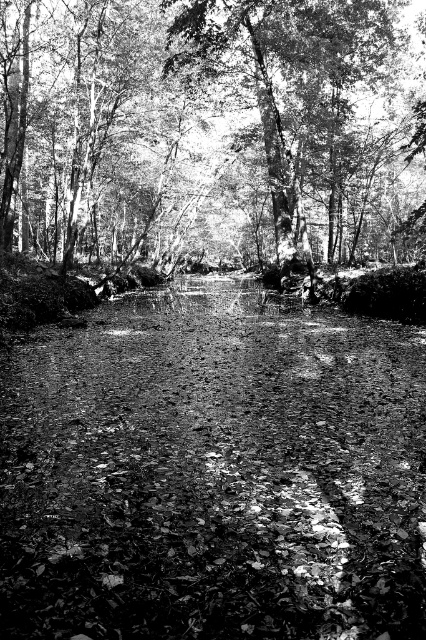
Question: Which point is farther from the camera taking this photo?

Choices:
 (A) (328, 106)
 (B) (322, 442)

Answer: (A)

Question: Observing the image, what is the correct spatial positioning of smooth dirt path at center in reference to smooth bark tree at center?

Choices:
 (A) above
 (B) below

Answer: (B)

Question: Which of the following is the closest to the observer?

Choices:
 (A) (104, 513)
 (B) (201, 168)

Answer: (A)

Question: Does smooth dirt path at center appear over smooth bark tree at center?

Choices:
 (A) yes
 (B) no

Answer: (B)

Question: Can you confirm if smooth dirt path at center is thinner than smooth bark tree at center?

Choices:
 (A) yes
 (B) no

Answer: (A)